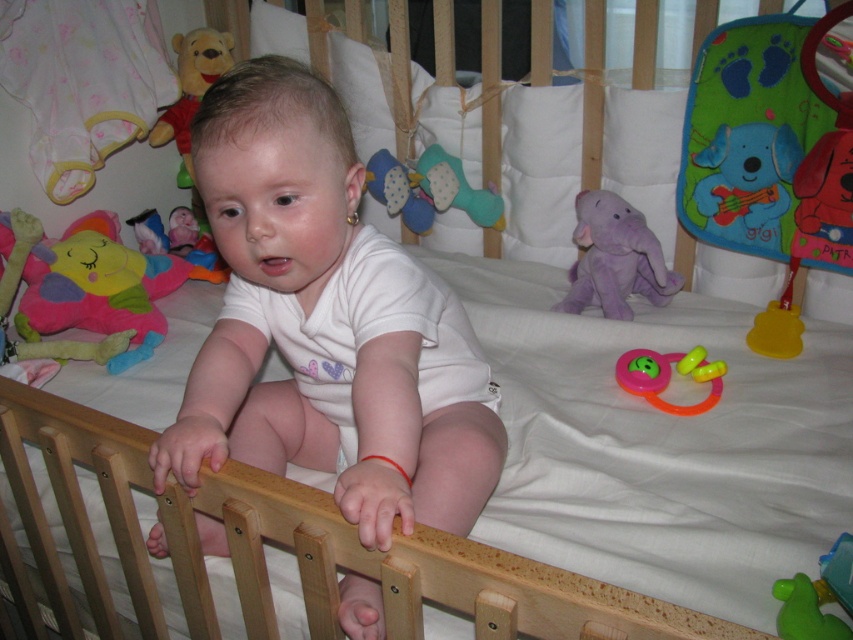
Is green plush toy at upper right to the right of green rubber duck at lower right from the viewer's perspective?

Indeed, green plush toy at upper right is positioned on the right side of green rubber duck at lower right.

Does point (776, 81) come behind point (850, 568)?

Yes, point (776, 81) is behind point (850, 568).

Who is more distant from viewer, (737, 61) or (808, 589)?

Positioned behind is point (737, 61).

The height and width of the screenshot is (640, 853). In order to click on green plush toy at upper right in this screenshot , I will do `click(769, 156)`.

Is green plush toy at upper right below soft plush star at left?

No.

Who is more distant from viewer, (706, 225) or (100, 276)?

Positioned behind is point (100, 276).

Does point (817, 150) come behind point (163, 284)?

No, (817, 150) is in front of (163, 284).

The height and width of the screenshot is (640, 853). I want to click on green plush toy at upper right, so click(x=769, y=156).

Who is taller, soft plush star at left or pink rubber teething ring at center?

With more height is soft plush star at left.

Is point (158, 308) farther from viewer compared to point (631, 387)?

Yes, it is behind point (631, 387).

The height and width of the screenshot is (640, 853). Identify the location of soft plush star at left. (90, 289).